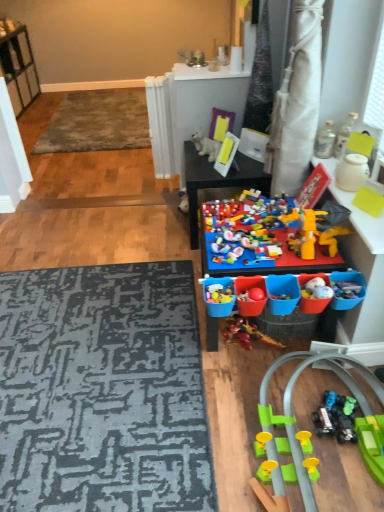
Question: Does point click(21, 54) appear closer or farther from the camera than point click(210, 144)?

Choices:
 (A) closer
 (B) farther

Answer: (B)

Question: In the image, is white plastic shelf at upper left positioned in front of or behind white plastic dog at center, placed as the 7th toy when sorted from bottom to top?

Choices:
 (A) front
 (B) behind

Answer: (B)

Question: Based on their relative distances, which object is nearer to the textured gray rug at upper left, the 2th mat positioned from the front?

Choices:
 (A) bright plastic lego set at center, which is counted as the fourth toy, starting from the top
 (B) metallic glass bottle at upper right, the 5th toy ordered from the bottom
 (C) white plastic shelf at upper left
 (D) yellow plastic figure at center, placed as the 5th toy when sorted from top to bottom
 (E) translucent glass bottle at upper right, which is the 2th toy in top-to-bottom order

Answer: (C)

Question: Considering the real-world distances, which object is farthest from the rubberized green track at lower right, which ranks as the seventh toy in top-to-bottom order?

Choices:
 (A) white plastic radiator at upper center
 (B) bright plastic lego set at center, which is counted as the fourth toy, starting from the top
 (C) multicolored plastic toy at center, the sixth toy positioned from the top
 (D) yellow plastic figure at center, the 3th toy in the bottom-to-top sequence
 (E) multicolored plastic toy at center

Answer: (A)